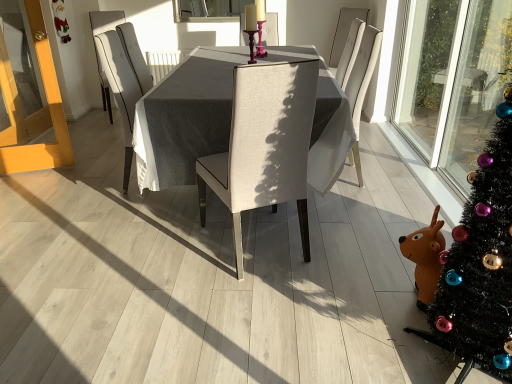
Where is `vacant space positioned to the left of black artificial christmas tree at right`? This screenshot has height=384, width=512. vacant space positioned to the left of black artificial christmas tree at right is located at coordinates (358, 340).